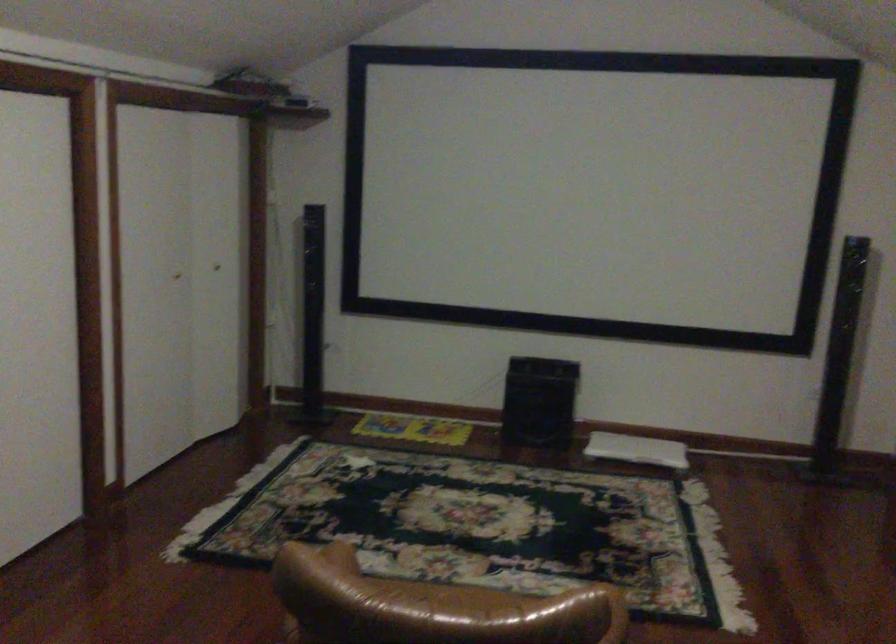
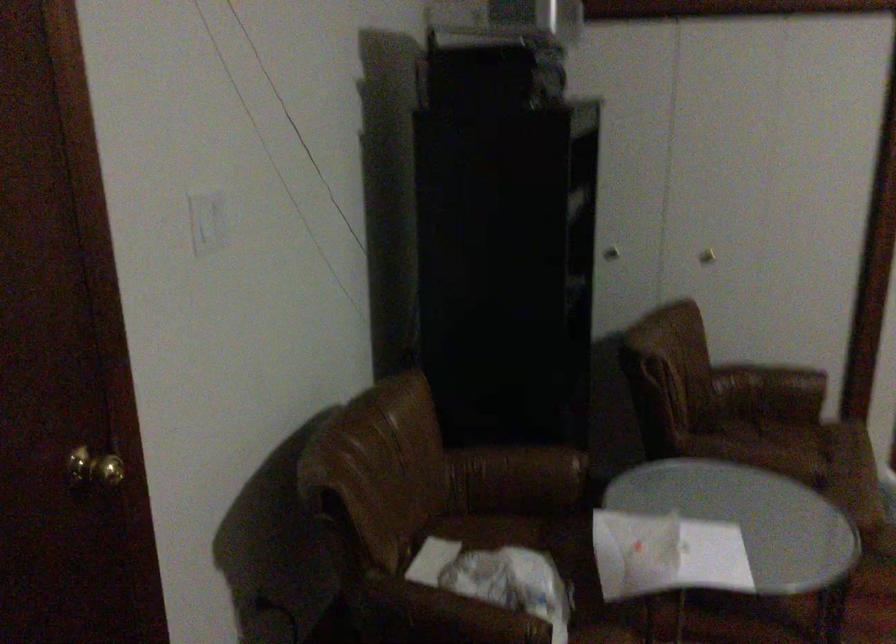
Question: The camera is either moving clockwise (left) or counter-clockwise (right) around the object. The first image is from the beginning of the video and the second image is from the end. Is the camera moving left or right when shooting the video?

Choices:
 (A) Left
 (B) Right

Answer: (B)